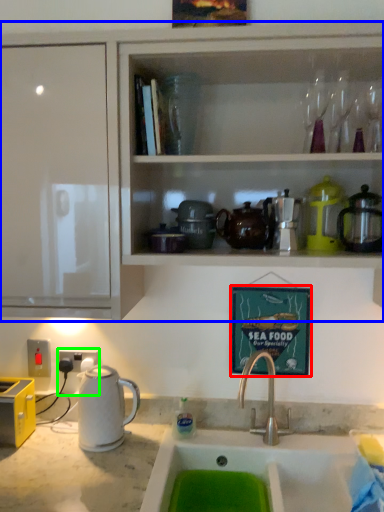
Question: Which object is positioned farthest from picture frame (highlighted by a red box)? Select from cabinetry (highlighted by a blue box) and electric outlet (highlighted by a green box).

Choices:
 (A) cabinetry
 (B) electric outlet

Answer: (B)